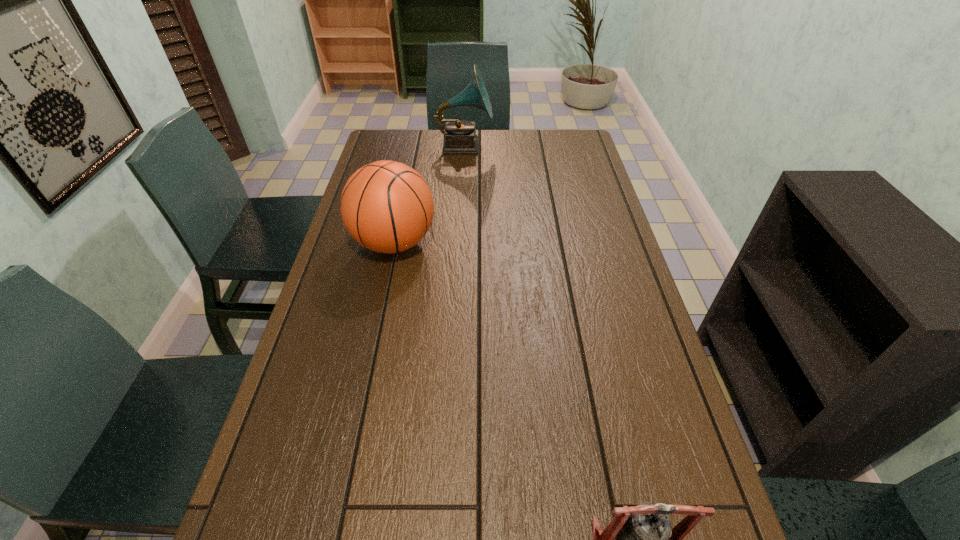
Locate an element on the screen. The image size is (960, 540). the tallest object is located at coordinates (460, 137).

Where is `the farthest object`? This screenshot has width=960, height=540. the farthest object is located at coordinates (460, 137).

Find the location of a particular element. The image size is (960, 540). basketball is located at coordinates (386, 206).

This screenshot has height=540, width=960. I want to click on vacant area situated 0.380m from the horn of the tallest object, so click(588, 146).

What are the coordinates of `vacant region located 0.340m on the front of the second nearest object` in the screenshot? It's located at (366, 376).

You are a GUI agent. You are given a task and a screenshot of the screen. Output one action in this format:
    pyautogui.click(x=<x>, y=<y>)
    Task: Click on the object positioned at the far edge
    This screenshot has height=540, width=960.
    Given the screenshot: What is the action you would take?
    pyautogui.click(x=460, y=137)

Where is `object located in the left edge section of the desktop`? This screenshot has width=960, height=540. object located in the left edge section of the desktop is located at coordinates (386, 206).

Identify the location of vacant space at the far edge of the desktop. (506, 153).

Find the location of a particular element. blank area at the left edge is located at coordinates (354, 268).

Locate an element on the screen. The image size is (960, 540). free point at the right edge is located at coordinates (620, 266).